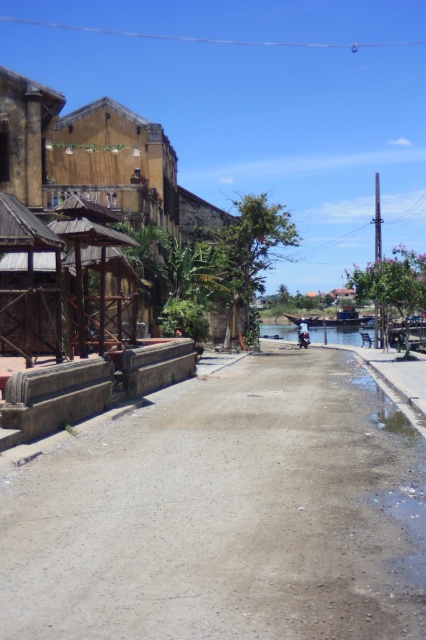
Looking at this image, which is more to the left, dull concrete alley at center or blue water at center?

Positioned to the left is dull concrete alley at center.

Is dull concrete alley at center bigger than blue water at center?

Incorrect, dull concrete alley at center is not larger than blue water at center.

This screenshot has height=640, width=426. What are the coordinates of `dull concrete alley at center` in the screenshot? It's located at (224, 512).

You are a GUI agent. You are given a task and a screenshot of the screen. Output one action in this format:
    pyautogui.click(x=<x>, y=<y>)
    Task: Click on the dull concrete alley at center
    This screenshot has height=640, width=426.
    Given the screenshot: What is the action you would take?
    pyautogui.click(x=224, y=512)

Can you confirm if wooden hut at upper left is wider than wooden hut at center?

Yes.

Does point (123, 128) come in front of point (106, 230)?

No.

Where is `wooden hut at upper left`? The width and height of the screenshot is (426, 640). wooden hut at upper left is located at coordinates (112, 164).

Is wooden hut at upper left further to the viewer compared to shiny silver motorcycle at center?

No, wooden hut at upper left is in front of shiny silver motorcycle at center.

Who is higher up, wooden hut at upper left or shiny silver motorcycle at center?

wooden hut at upper left is above.

At what (x,y) coordinates should I click in order to perform the action: click on wooden hut at upper left. Please return your answer as a coordinate pair (x, y). The image size is (426, 640). Looking at the image, I should click on (112, 164).

What are the coordinates of `wooden hut at upper left` in the screenshot? It's located at (112, 164).